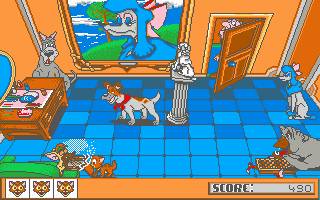
You are a GUI agent. You are given a task and a screenshot of the screen. Output one action in this format:
    pyautogui.click(x=<x>, y=<y>)
    Task: Click on the tray
    The width and height of the screenshot is (320, 200).
    Given the screenshot: What is the action you would take?
    pyautogui.click(x=42, y=101)